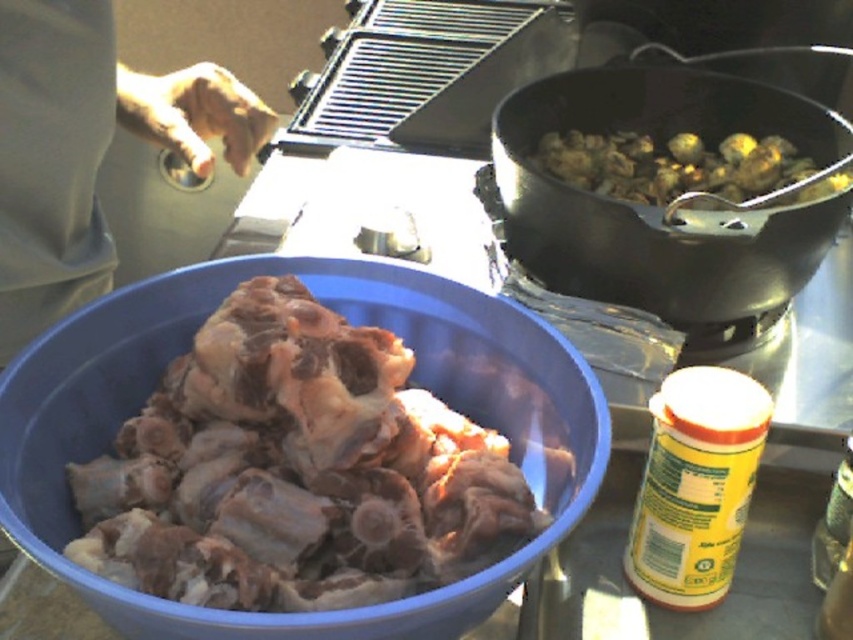
In the scene shown: What is located at the coordinates point (296, 470) in the image?

The point (296, 470) indicates a brown matte bone at center.

You are a chef preparing a meal and need to choose between the brown matte bone at center and the brown skin at upper left for a dish that requires a larger ingredient. Which one should you pick?

The brown skin at upper left is larger than the brown matte bone at center, so you should pick the brown skin at upper left for the dish that requires a larger ingredient.